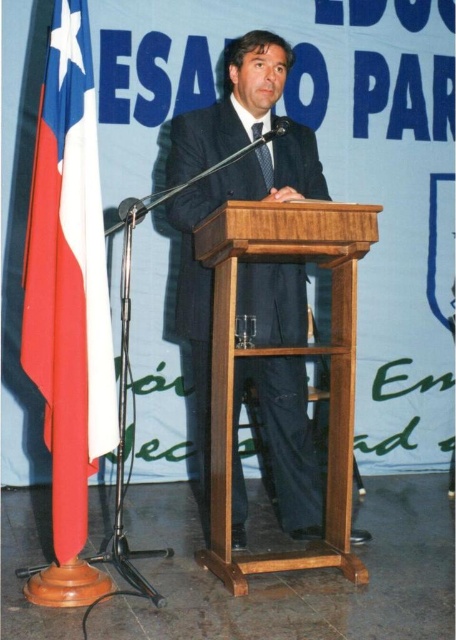
Question: Is dark blue suit at center below red fabric flag at left?

Choices:
 (A) yes
 (B) no

Answer: (A)

Question: Which point appears farthest from the camera in this image?

Choices:
 (A) (65, 426)
 (B) (177, 163)

Answer: (B)

Question: From the image, what is the correct spatial relationship of red fabric flag at left in relation to black silk tie at center?

Choices:
 (A) above
 (B) below

Answer: (B)

Question: Which object is farther from the camera taking this photo?

Choices:
 (A) dark blue suit at center
 (B) black silk tie at center
 (C) red fabric flag at left

Answer: (B)

Question: Which of these objects is positioned farthest from the dark blue suit at center?

Choices:
 (A) black silk tie at center
 (B) red fabric flag at left

Answer: (B)

Question: Can you confirm if dark blue suit at center is smaller than red fabric flag at left?

Choices:
 (A) yes
 (B) no

Answer: (B)